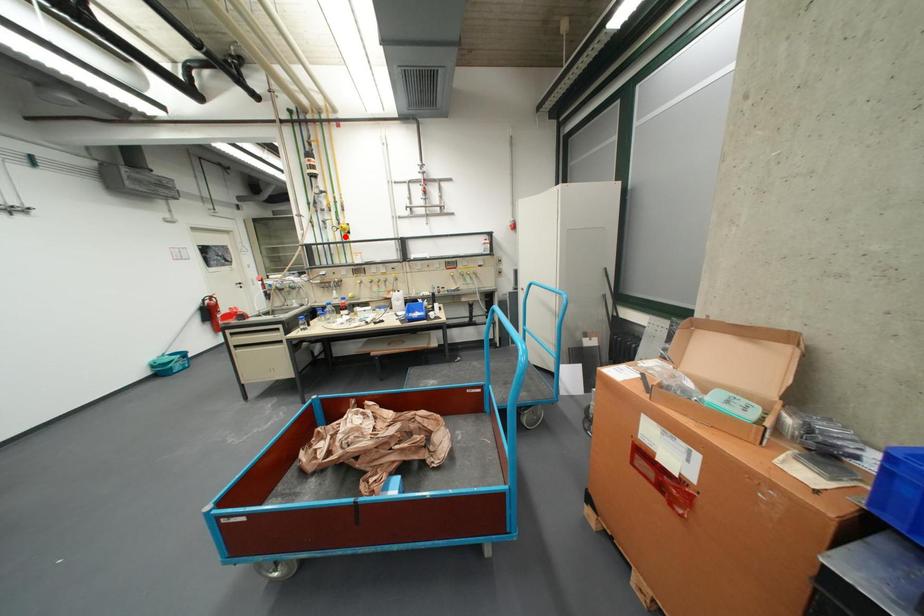
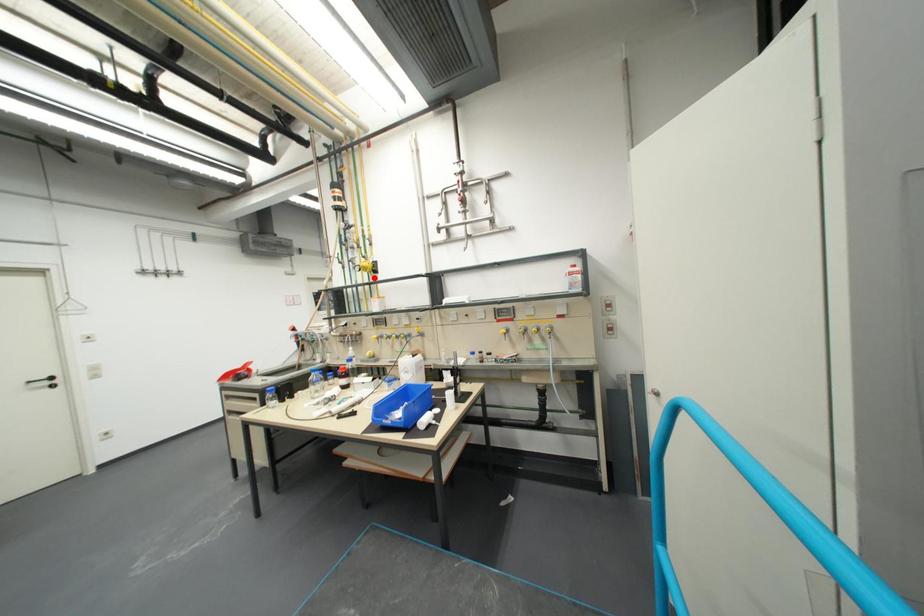
I am providing you with two images of the same scene from different viewpoints. A red point is marked on the first image and another point is marked on the second image. Is the marked point in image1 the same physical position as the marked point in image2?

Yes